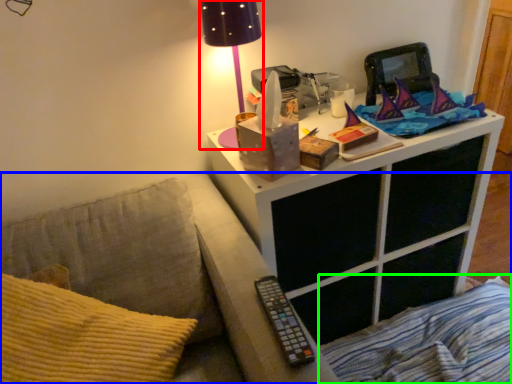
Question: Estimate the real-world distances between objects in this image. Which object is closer to table lamp (highlighted by a red box), furniture (highlighted by a blue box) or bedding (highlighted by a green box)?

Choices:
 (A) furniture
 (B) bedding

Answer: (A)